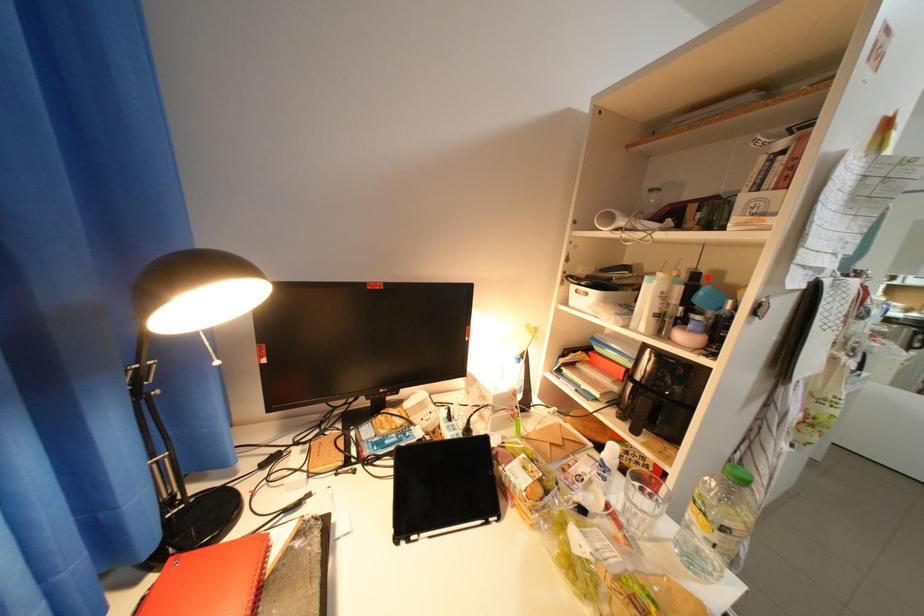
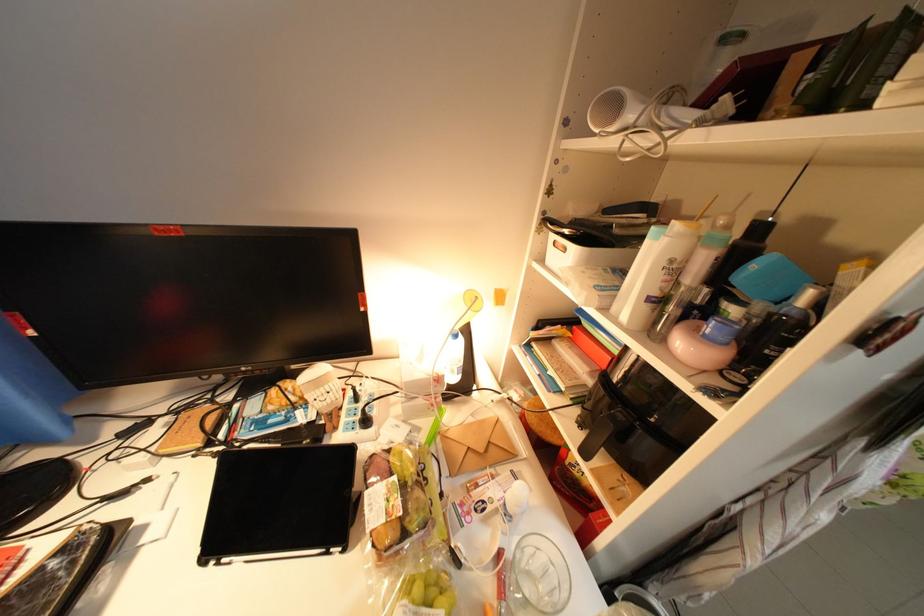
Question: I am providing you with two images of the same scene from different viewpoints. A red point is marked on the first image. Is the red point's position out of view in image 2?

Choices:
 (A) Yes
 (B) No

Answer: (B)